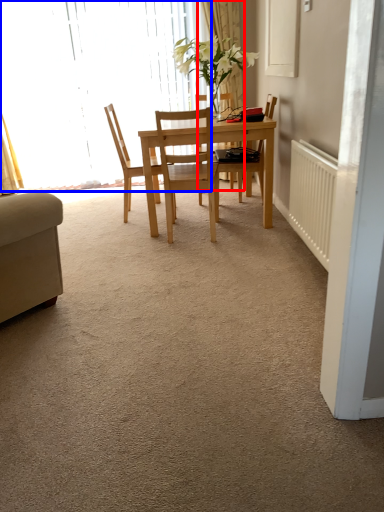
Question: Which object is closer to the camera taking this photo, curtain (highlighted by a red box) or window (highlighted by a blue box)?

Choices:
 (A) curtain
 (B) window

Answer: (A)